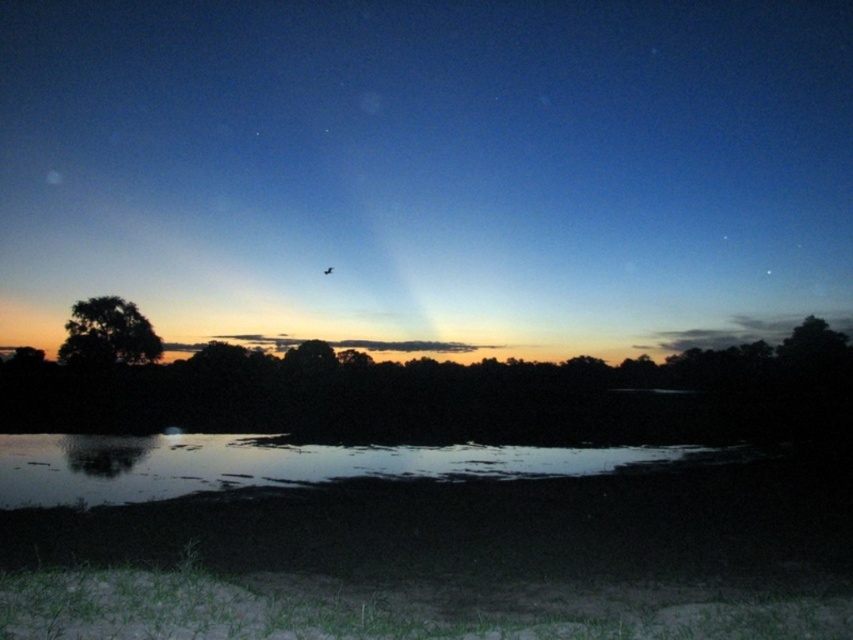
Question: Which of the following is the farthest from the observer?

Choices:
 (A) (277, 458)
 (B) (119, 308)

Answer: (B)

Question: Which object is positioned farthest from the green leafy tree at left?

Choices:
 (A) silky blue sky at center
 (B) glossy reflective water at center

Answer: (B)

Question: Which of these objects is positioned closest to the green leafy tree at left?

Choices:
 (A) silky blue sky at center
 (B) glossy reflective water at center

Answer: (A)

Question: Where is silky blue sky at center located in relation to glossy reflective water at center in the image?

Choices:
 (A) left
 (B) right

Answer: (B)

Question: Is glossy reflective water at center further to the viewer compared to green leafy tree at left?

Choices:
 (A) yes
 (B) no

Answer: (B)

Question: Is silky blue sky at center wider than green leafy tree at left?

Choices:
 (A) yes
 (B) no

Answer: (A)